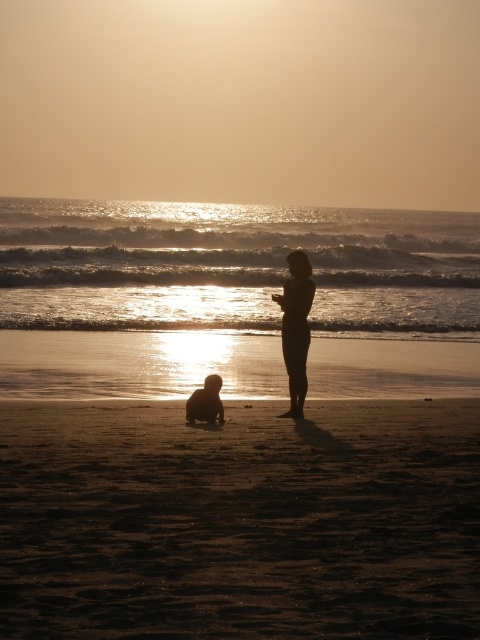
You are a photographer trying to capture the sunset at the beach. You notice the dark sand at center and the silhouette sand at lower center. Which area would you focus on to ensure the sand texture is clearly visible in your photo?

The silhouette sand at lower center should be focused on because it is larger in size compared to the dark sand at center, making its texture more visible.

You are standing on the beach and see the dark sand at center. There is a seashell 7.40 meters away from it. Can you reach the seashell without walking?

The seashell is 7.40 meters away from the dark sand at center, so you cannot reach it without walking.